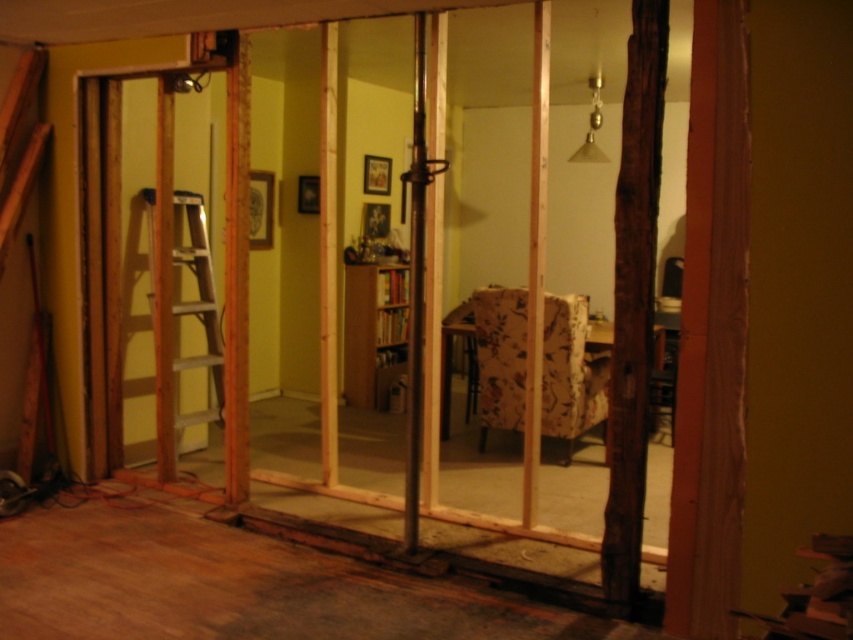
You are a contractor working in the construction area. You need to determine if the wooden at left can be used as a support beam for the wooden ladder at left. Can it be used based on their heights?

The wooden at left is taller than the wooden ladder at left, so it can be used as a support beam since it is taller and likely more stable.

You are a construction worker carrying a tool that is 4 meters long. You need to move it through the doorway into the room with the yellowish green walls. Can you safely carry the tool through the doorway without it hitting the wooden at left or the camera?

The wooden at left and camera are 3.89 meters apart from each other. Since the tool is 4 meters long, it is longer than the distance between the two objects. Therefore, you cannot safely carry the tool through the doorway without it hitting the wooden at left or the camera.

You are standing in the construction area and see the point marked at coordinates (166, 296). Based on the scene description, what material is this point located on?

The point marked at coordinates (166, 296) is located on wooden at left as stated in the object description.